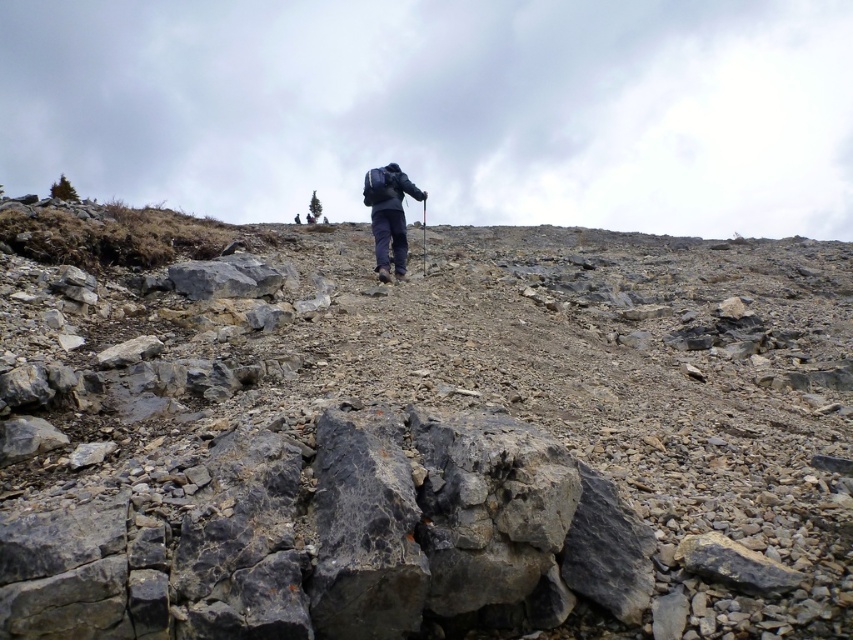
At what (x,y) coordinates should I click in order to perform the action: click on gray rocky hillside at center. Please return your answer as a coordinate pair (x, y). This screenshot has height=640, width=853. Looking at the image, I should click on (431, 442).

Who is shorter, gray rocky hillside at center or dark blue fabric backpack at center?

Standing shorter between the two is dark blue fabric backpack at center.

Is point (802, 410) closer to viewer compared to point (407, 188)?

Yes, it is in front of point (407, 188).

The image size is (853, 640). In order to click on gray rocky hillside at center in this screenshot , I will do `click(431, 442)`.